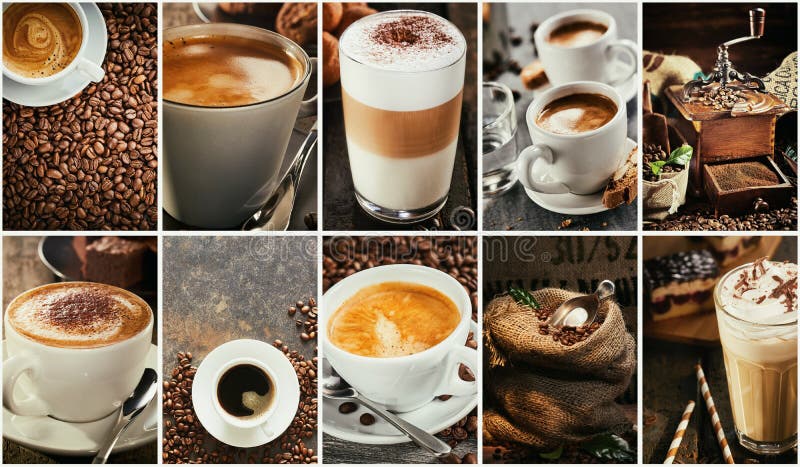
Where is `plates`? The height and width of the screenshot is (467, 800). plates is located at coordinates (370, 429), (68, 436), (66, 83), (578, 200).